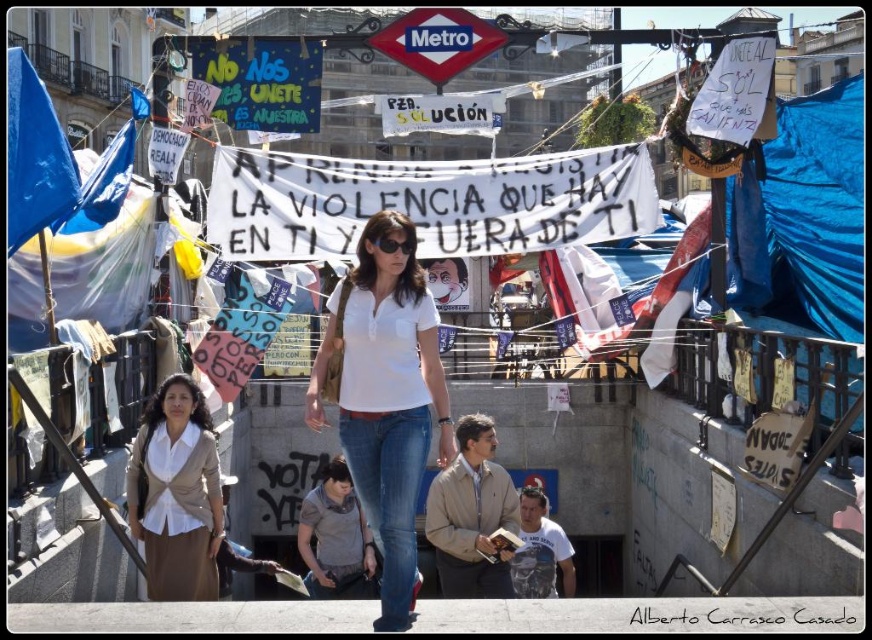
Is white matte shirt at center wider than denim jeans at center?

Yes, white matte shirt at center is wider than denim jeans at center.

Does white matte shirt at center lie in front of denim jeans at center?

No.

Is point (392, 461) positioned behind point (410, 420)?

No.

At what (x,y) coordinates should I click in order to perform the action: click on white matte shirt at center. Please return your answer as a coordinate pair (x, y). Looking at the image, I should click on (x=385, y=396).

Can you confirm if beige fabric blouse at lower left is smaller than denim jeans at center?

Correct, beige fabric blouse at lower left occupies less space than denim jeans at center.

How much distance is there between beige fabric blouse at lower left and denim jeans at center?

The distance of beige fabric blouse at lower left from denim jeans at center is 12.50 meters.

Measure the distance between point (174,540) and camera.

The distance of point (174,540) from camera is 54.91 meters.

What are the coordinates of `beige fabric blouse at lower left` in the screenshot? It's located at (176, 493).

Does white matte shirt at center appear on the left side of beige fabric blouse at lower left?

Incorrect, white matte shirt at center is not on the left side of beige fabric blouse at lower left.

Image resolution: width=872 pixels, height=640 pixels. I want to click on white matte shirt at center, so click(x=385, y=396).